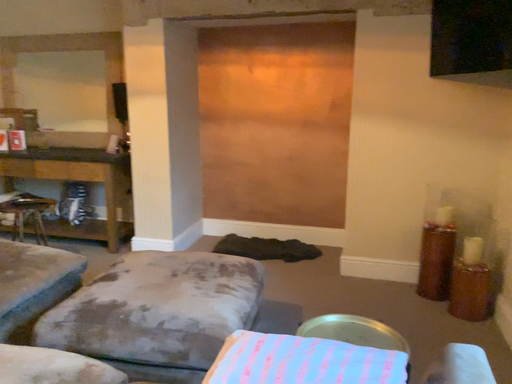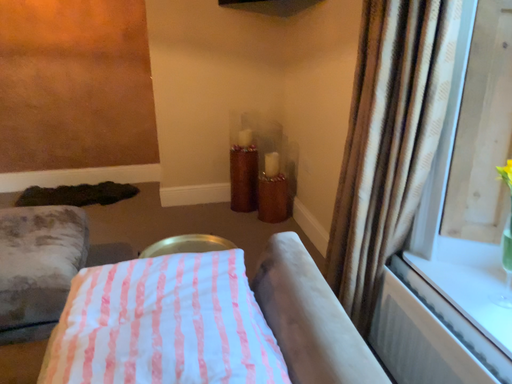
Question: Which way did the camera rotate in the video?

Choices:
 (A) rotated upward
 (B) rotated downward

Answer: (B)